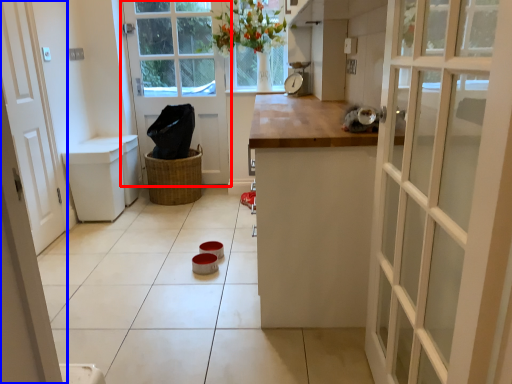
Question: Which object is further to the camera taking this photo, door (highlighted by a red box) or door (highlighted by a blue box)?

Choices:
 (A) door
 (B) door

Answer: (A)